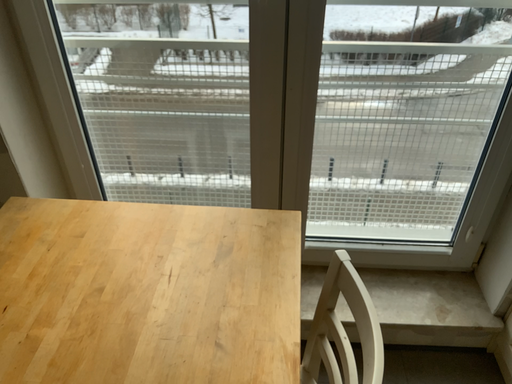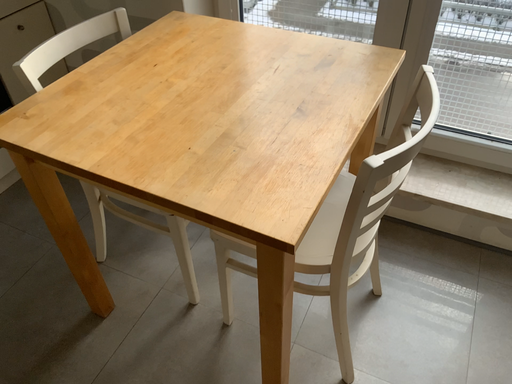
Question: Which way did the camera rotate in the video?

Choices:
 (A) rotated left
 (B) rotated right

Answer: (A)